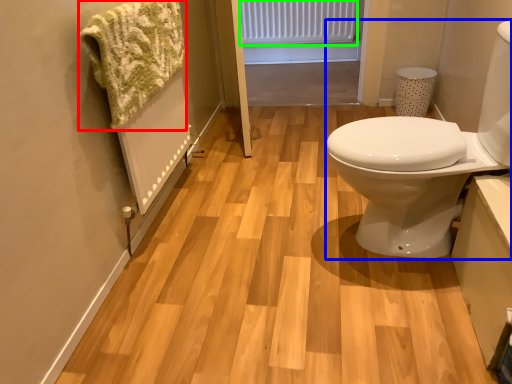
Question: Which is farther away from bath towel (highlighted by a red box)? sink (highlighted by a blue box) or radiator (highlighted by a green box)?

Choices:
 (A) sink
 (B) radiator

Answer: (B)